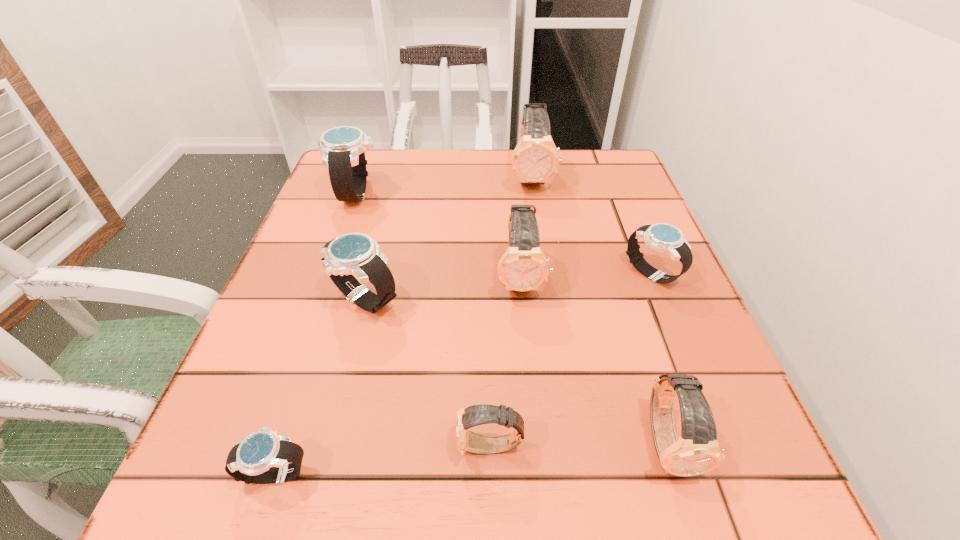
Where is `object present at the near left corner`? This screenshot has width=960, height=540. object present at the near left corner is located at coordinates (263, 457).

Find the location of a particular element. The height and width of the screenshot is (540, 960). object present at the near right corner is located at coordinates (697, 451).

Find the location of `blank space at the far edge of the desktop`. blank space at the far edge of the desktop is located at coordinates (400, 185).

Where is `vacant space at the left edge of the desktop`? The height and width of the screenshot is (540, 960). vacant space at the left edge of the desktop is located at coordinates click(x=300, y=372).

This screenshot has height=540, width=960. Identify the location of vacant space at the right edge. (620, 268).

I want to click on vacant region at the far left corner of the desktop, so click(384, 175).

Where is `vacant space in between the rightmost gold watch and the second biggest silver watch`? Image resolution: width=960 pixels, height=540 pixels. vacant space in between the rightmost gold watch and the second biggest silver watch is located at coordinates (516, 370).

Where is `vacant space that's between the biggest silver watch and the second biggest gold watch`? This screenshot has height=540, width=960. vacant space that's between the biggest silver watch and the second biggest gold watch is located at coordinates (439, 235).

Find the location of a particular element. free point between the farthest silver watch and the rightmost silver watch is located at coordinates (504, 234).

Locate an element on the screen. unoccupied area between the rightmost silver watch and the second farthest gold watch is located at coordinates (586, 275).